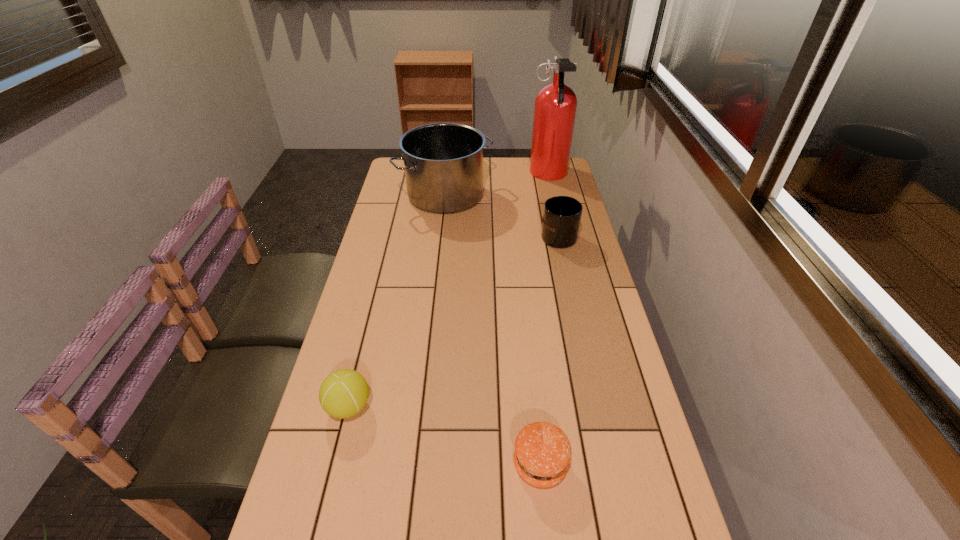
You are a GUI agent. You are given a task and a screenshot of the screen. Output one action in this format:
    pyautogui.click(x=<x>, y=<y>)
    Task: Click on the vacant area that lies between the third object from right to left and the second tallest object
    
    Given the screenshot: What is the action you would take?
    pyautogui.click(x=492, y=329)

Where is `the fourth closest object to the fourth tallest object`? Image resolution: width=960 pixels, height=540 pixels. the fourth closest object to the fourth tallest object is located at coordinates (555, 105).

Where is `the closest object to the second shortest object`? The image size is (960, 540). the closest object to the second shortest object is located at coordinates (542, 453).